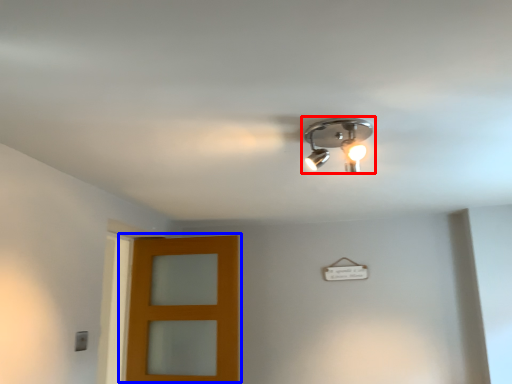
Question: Among these objects, which one is nearest to the camera, lamp (highlighted by a red box) or door (highlighted by a blue box)?

Choices:
 (A) lamp
 (B) door

Answer: (A)